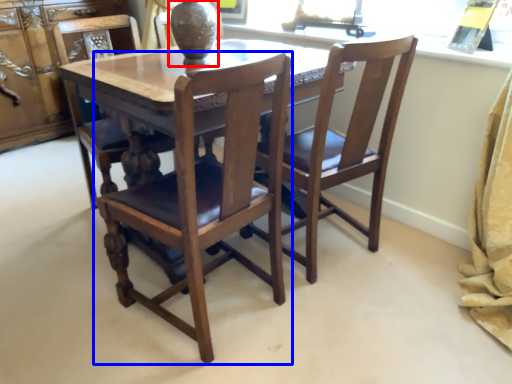
Question: Which of the following is the closest to the observer, glass vase (highlighted by a red box) or chair (highlighted by a blue box)?

Choices:
 (A) glass vase
 (B) chair

Answer: (B)